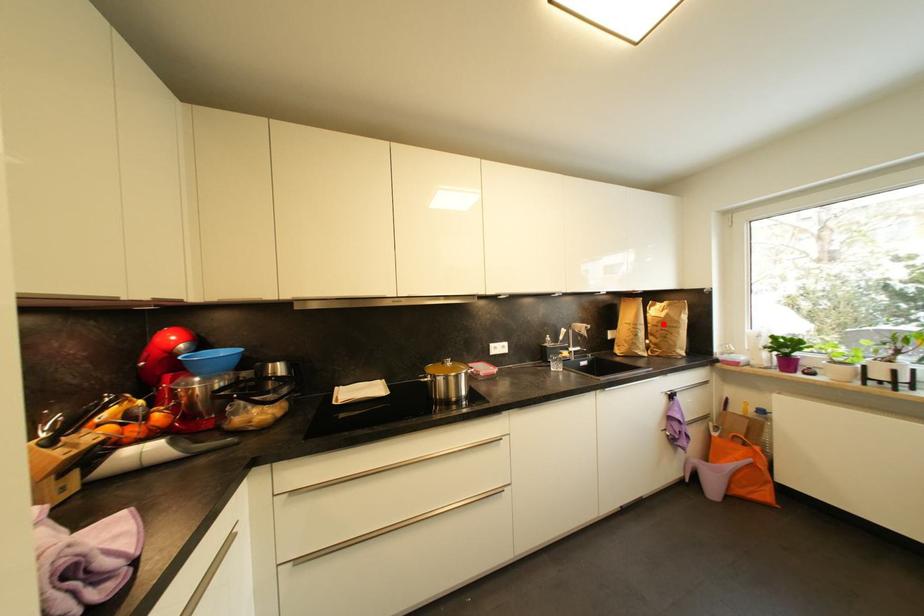
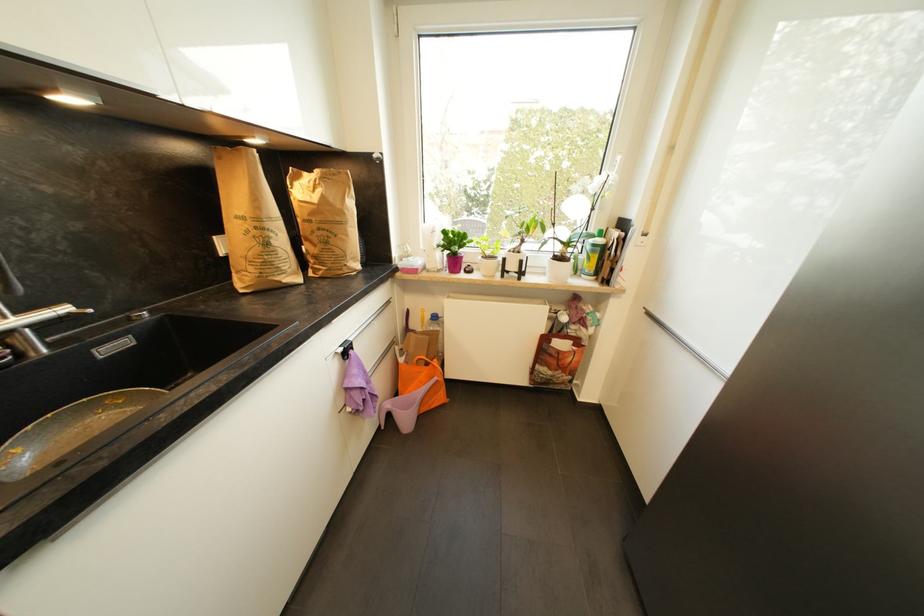
Locate, in the second image, the point that corresponds to the highlighted location in the first image.

(317, 216)